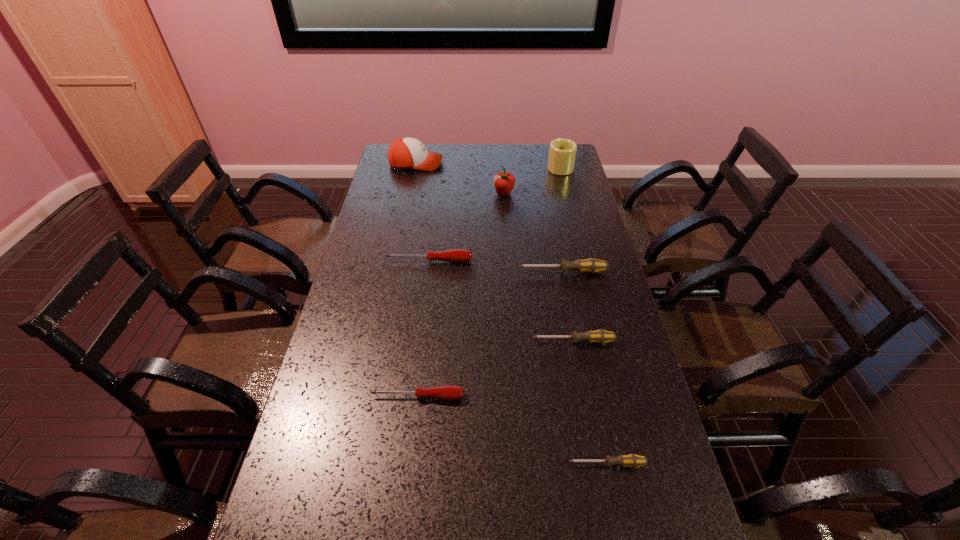
The height and width of the screenshot is (540, 960). Find the location of `screwdriver that is the closest to the fifth farthest object`. screwdriver that is the closest to the fifth farthest object is located at coordinates (457, 255).

Identify which gray screwdriver is located as the nearest to the orange baseball cap. Please provide its 2D coordinates. Your answer should be formatted as a tuple, i.e. [(x, y)], where the tuple contains the x and y coordinates of a point satisfying the conditions above.

[(591, 265)]

Where is `gray screwdriver that can be found as the second closest to the smallest gray screwdriver`? This screenshot has width=960, height=540. gray screwdriver that can be found as the second closest to the smallest gray screwdriver is located at coordinates (591, 265).

Locate an element on the screen. This screenshot has height=540, width=960. red screwdriver that is the nearest to the second nearest gray screwdriver is located at coordinates (447, 392).

Locate which red screwdriver ranks second in proximity to the nearest screwdriver. Please provide its 2D coordinates. Your answer should be formatted as a tuple, i.e. [(x, y)], where the tuple contains the x and y coordinates of a point satisfying the conditions above.

[(457, 255)]

I want to click on free space in the image that satisfies the following two spatial constraints: 1. on the back side of the apple; 2. on the left side of the nearer red screwdriver, so click(441, 193).

At what (x,y) coordinates should I click in order to perform the action: click on free point that satisfies the following two spatial constraints: 1. on the front-facing side of the orange baseball cap; 2. on the back side of the apple. Please return your answer as a coordinate pair (x, y). Image resolution: width=960 pixels, height=540 pixels. Looking at the image, I should click on 410,193.

Find the location of a particular element. Image resolution: width=960 pixels, height=540 pixels. vacant space that satisfies the following two spatial constraints: 1. on the front-facing side of the second nearest object; 2. on the left side of the baseball cap is located at coordinates (369, 396).